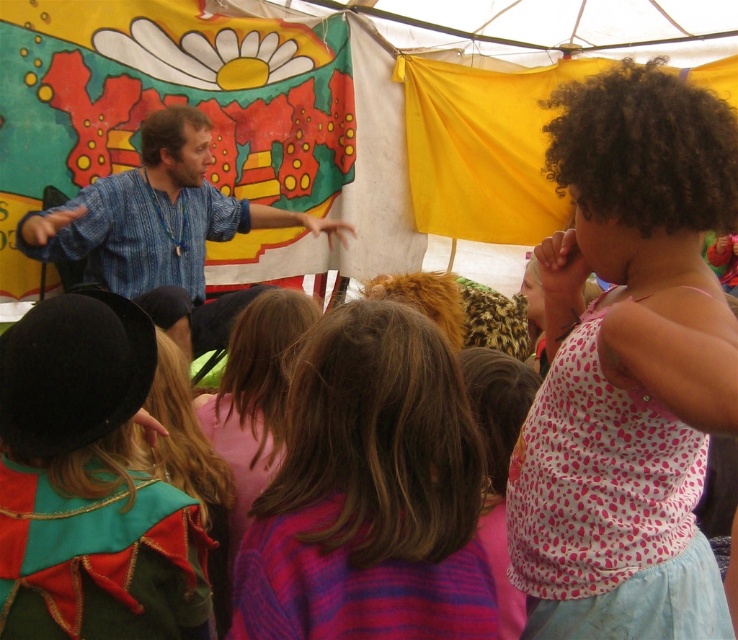
Question: Does pink dotted tank top at upper right have a smaller size compared to velvet green cape at lower left?

Choices:
 (A) yes
 (B) no

Answer: (B)

Question: Which point is closer to the camera?

Choices:
 (A) blonde hair at center
 (B) multicolored striped sweater at center
 (C) velvet green cape at lower left
 (D) yellow fabric tent at upper center

Answer: (B)

Question: Is pink dotted tank top at upper right smaller than blonde hair at center?

Choices:
 (A) yes
 (B) no

Answer: (B)

Question: Which point appears closest to the camera in this image?

Choices:
 (A) (303, 369)
 (B) (292, 310)

Answer: (A)

Question: Is velvet green cape at lower left smaller than blonde hair at center?

Choices:
 (A) no
 (B) yes

Answer: (B)

Question: Which is farther from the pink dotted tank top at upper right?

Choices:
 (A) yellow fabric tent at upper center
 (B) blonde hair at center

Answer: (A)